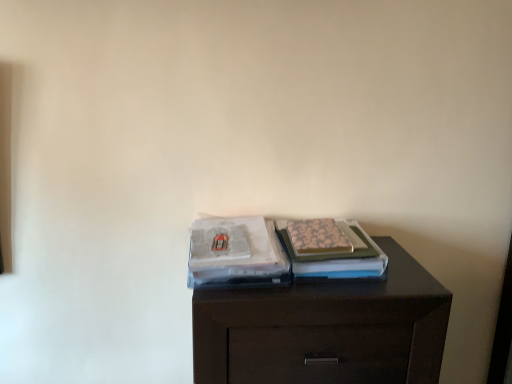
At what (x,y) coordinates should I click in order to perform the action: click on free spot above patterned paper magazine at center, which ranks as the 2th magazine in left-to-right order (from a real-world perspective). Please return your answer as a coordinate pair (x, y). Looking at the image, I should click on (321, 232).